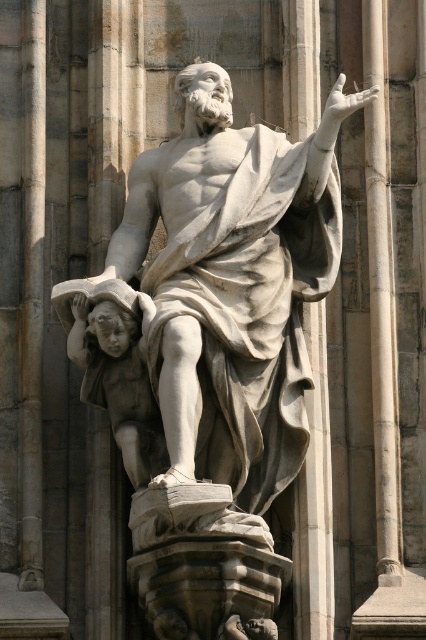
Can you confirm if white marble statue at center is taller than smooth gray cherub at lower left?

Yes, white marble statue at center is taller than smooth gray cherub at lower left.

Consider the image. Is white marble statue at center further to the viewer compared to smooth gray cherub at lower left?

No, white marble statue at center is in front of smooth gray cherub at lower left.

Based on the photo, measure the distance between white marble statue at center and camera.

white marble statue at center and camera are 68.36 meters apart from each other.

Identify the location of white marble statue at center. The width and height of the screenshot is (426, 640). (233, 282).

Can you confirm if white marble pillar at center is shorter than smooth gray cherub at lower left?

Incorrect, white marble pillar at center's height does not fall short of smooth gray cherub at lower left's.

Is point (305, 557) behind point (124, 442)?

Yes, point (305, 557) is farther from viewer.

Which is in front, point (313, 440) or point (80, 396)?

Point (313, 440) is more forward.

Identify the location of white marble pillar at center. Image resolution: width=426 pixels, height=640 pixels. (314, 499).

Does point (294, 196) lie in front of point (304, 20)?

Yes, point (294, 196) is in front of point (304, 20).

Who is more forward, (327, 128) or (325, 474)?

Point (327, 128) is more forward.

Image resolution: width=426 pixels, height=640 pixels. Identify the location of white marble statue at center. (233, 282).